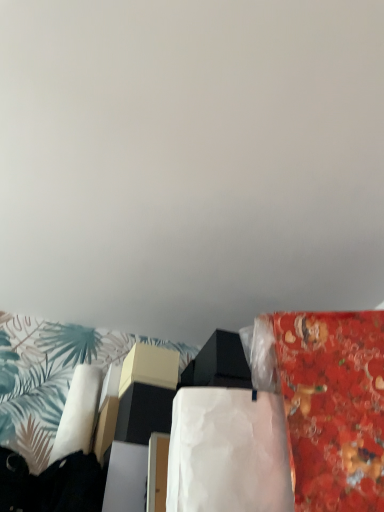
Question: In terms of size, does white paper at center appear bigger or smaller than red glossy fabric at right?

Choices:
 (A) big
 (B) small

Answer: (B)

Question: Considering the positions of white paper at center and red glossy fabric at right in the image, is white paper at center wider or thinner than red glossy fabric at right?

Choices:
 (A) wide
 (B) thin

Answer: (A)

Question: Is point (185, 459) positioned closer to the camera than point (360, 384)?

Choices:
 (A) farther
 (B) closer

Answer: (B)

Question: Is red glossy fabric at right in front of or behind white paper at center in the image?

Choices:
 (A) front
 (B) behind

Answer: (A)

Question: Looking at the image, does red glossy fabric at right seem bigger or smaller compared to white paper at center?

Choices:
 (A) small
 (B) big

Answer: (B)

Question: From a real-world perspective, is red glossy fabric at right physically located above or below white paper at center?

Choices:
 (A) below
 (B) above

Answer: (B)

Question: From the image's perspective, is red glossy fabric at right above or below white paper at center?

Choices:
 (A) above
 (B) below

Answer: (A)